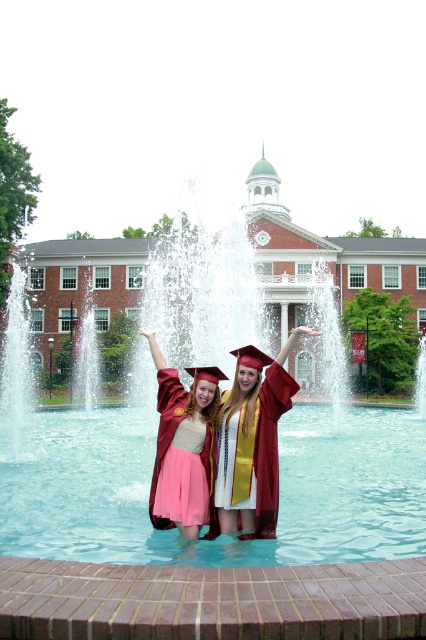
You are a photographer trying to capture a photo of the maroon satin gown at center and the matte pink skirt at center. Which one should you focus on first if you want to ensure both are in focus without adjusting the camera settings?

The maroon satin gown at center should be focused on first because it is shorter than the matte pink skirt at center, so focusing on the closer object first ensures both will be in focus.

You are standing at point A and want to walk to point B. The path between them is blocked by a large tree. However, you notice two points marked in the image. Point A is at point [123,461] and point B is at point [196,451]. Which point should you choose to go around the tree and reach your destination?

Point A is behind point B, so to go around the tree, you should choose point B as your path since it is closer to your destination.